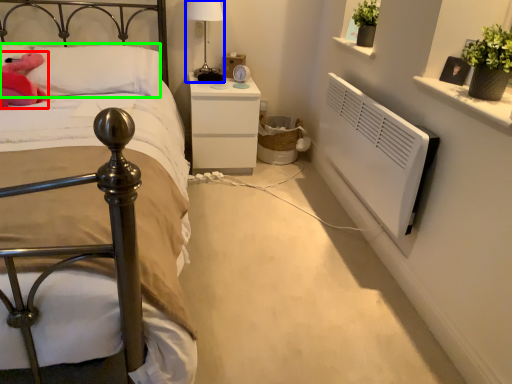
Question: Which object is the closest to the animal (highlighted by a red box)? Choose among these: bedside lamp (highlighted by a blue box) or pillow (highlighted by a green box).

Choices:
 (A) bedside lamp
 (B) pillow

Answer: (B)